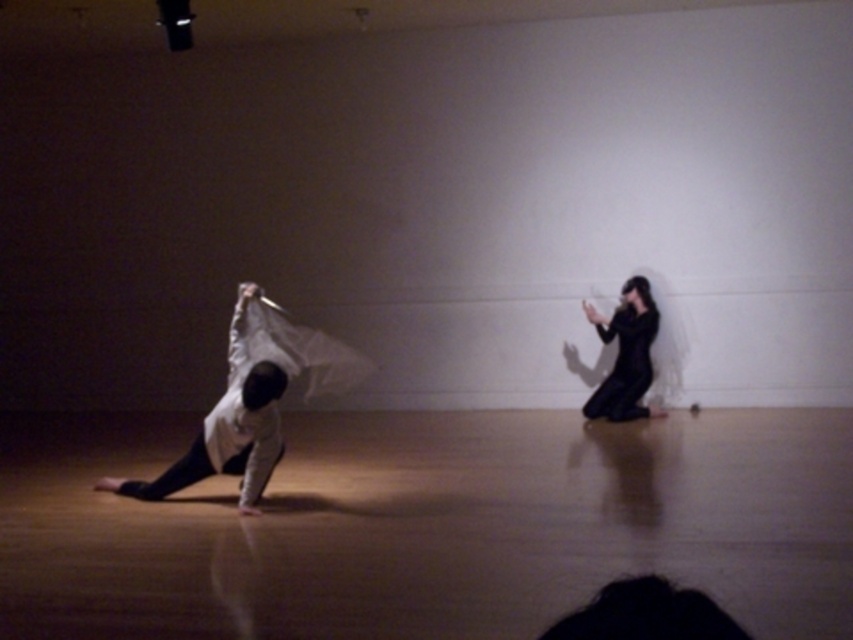
Is white matte fabric at left positioned in front of black matte dress at right?

Yes, it is.

From the picture: Is white matte fabric at left taller than black matte dress at right?

Yes.

Describe the element at coordinates (252, 401) in the screenshot. I see `white matte fabric at left` at that location.

At what (x,y) coordinates should I click in order to perform the action: click on white matte fabric at left. Please return your answer as a coordinate pair (x, y). This screenshot has height=640, width=853. Looking at the image, I should click on (252, 401).